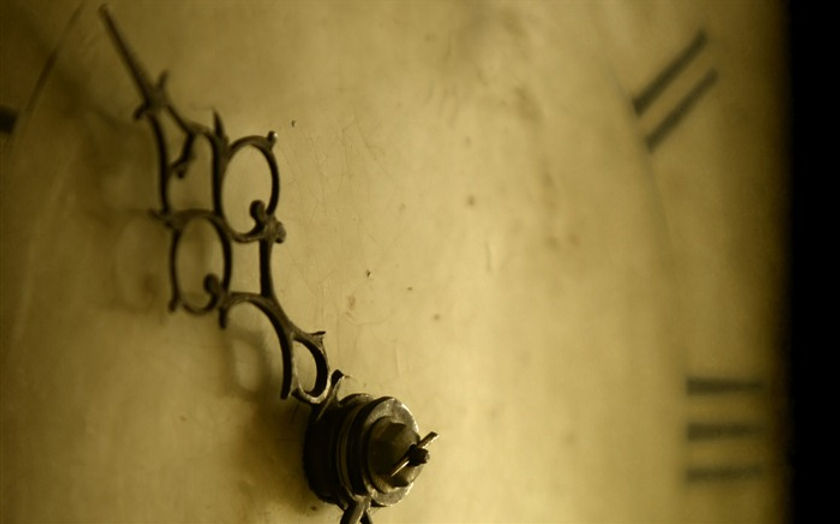
I want to click on clock hand, so click(265, 310), click(357, 506).